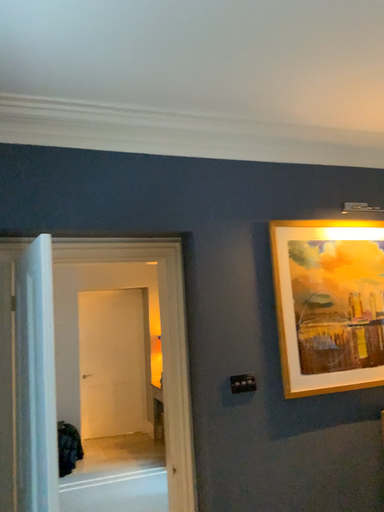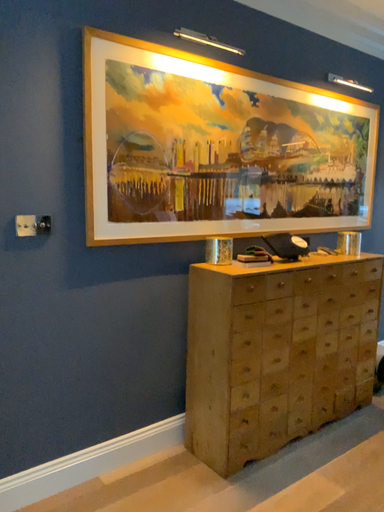
Question: Which way did the camera rotate in the video?

Choices:
 (A) rotated downward
 (B) rotated upward

Answer: (A)